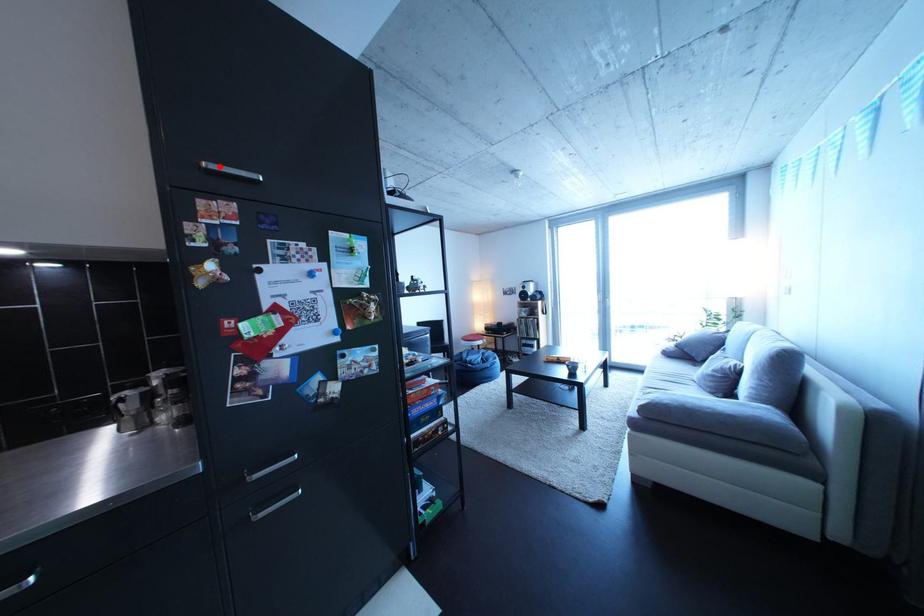
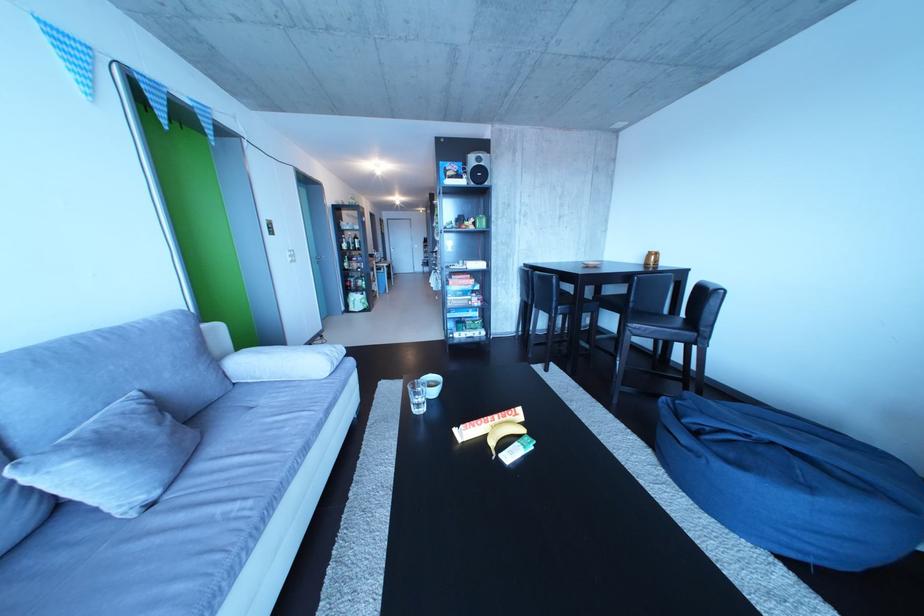
Question: I am providing you with two images of the same scene from different viewpoints. A red point is marked on the first image. Is the red point's position out of view in image 2?

Choices:
 (A) Yes
 (B) No

Answer: (A)